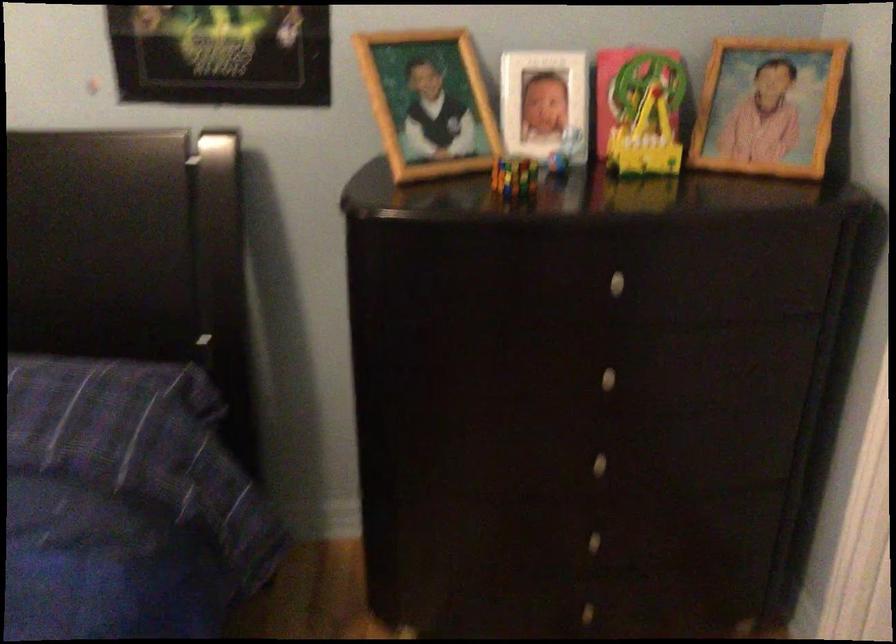
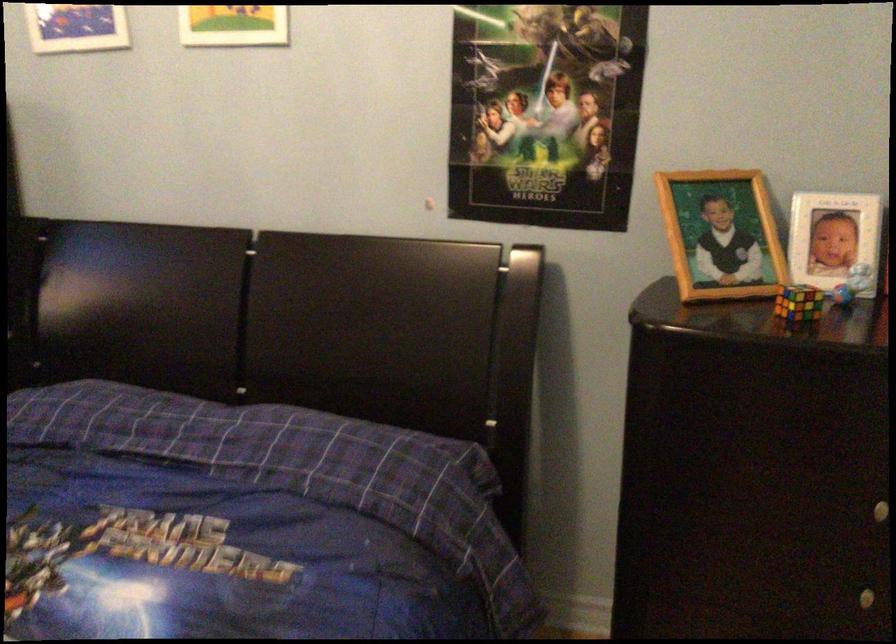
In the second image, find the point that corresponds to pixel 427 105 in the first image.

(720, 234)